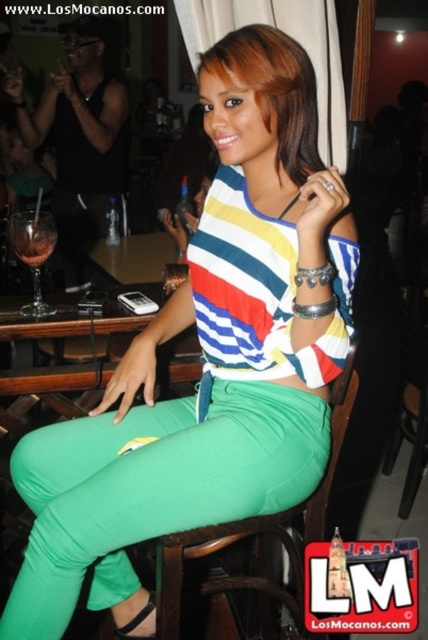
Is green fabric pants at center to the right of green fabric chair at center from the viewer's perspective?

Incorrect, green fabric pants at center is not on the right side of green fabric chair at center.

Does green fabric pants at center appear under green fabric chair at center?

Actually, green fabric pants at center is above green fabric chair at center.

Where is `green fabric pants at center`? This screenshot has height=640, width=428. green fabric pants at center is located at coordinates (151, 486).

Measure the distance between point (x=184, y=500) and camera.

Point (x=184, y=500) is 38.18 inches away from camera.

At what (x,y) coordinates should I click in order to perform the action: click on green fabric pants at center. Please return your answer as a coordinate pair (x, y). This screenshot has width=428, height=640. Looking at the image, I should click on (151, 486).

Identify the location of green fabric pants at center. (151, 486).

You are a GUI agent. You are given a task and a screenshot of the screen. Output one action in this format:
    pyautogui.click(x=<x>, y=<y>)
    Task: Click on the green fabric pants at center
    This screenshot has width=428, height=640.
    Given the screenshot: What is the action you would take?
    pyautogui.click(x=151, y=486)

Who is higher up, green fabric chair at center or translucent glass wine at left?

translucent glass wine at left is above.

Does point (205, 534) come in front of point (17, 214)?

Yes, it is in front of point (17, 214).

At what (x,y) coordinates should I click in order to perform the action: click on green fabric chair at center. Please return your answer as a coordinate pair (x, y). Looking at the image, I should click on (204, 556).